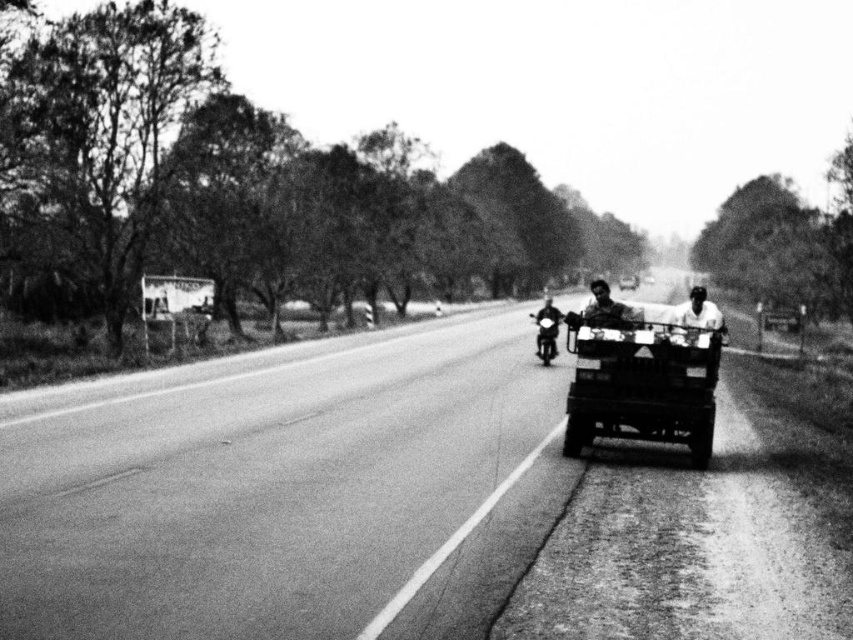
You are standing at the center of the road in the image and want to look directly at the smooth skin face at center. In which direction should you turn your head?

The smooth skin face at center is located at the center of the image, so you don not need to turn your head. Just look straight ahead.

You are a delivery driver who needs to pass through a narrow tunnel that can only accommodate vehicles with a width of 1.5 meters. You see the metallic flatbed cart at center and the metallic silver motorcycle at center in the scene. Which vehicle would you choose to take through the tunnel?

The metallic flatbed cart at center is thinner than the metallic silver motorcycle at center, so you should choose the metallic flatbed cart at center to pass through the tunnel since it is narrower and fits within the 1.5 meters width requirement.